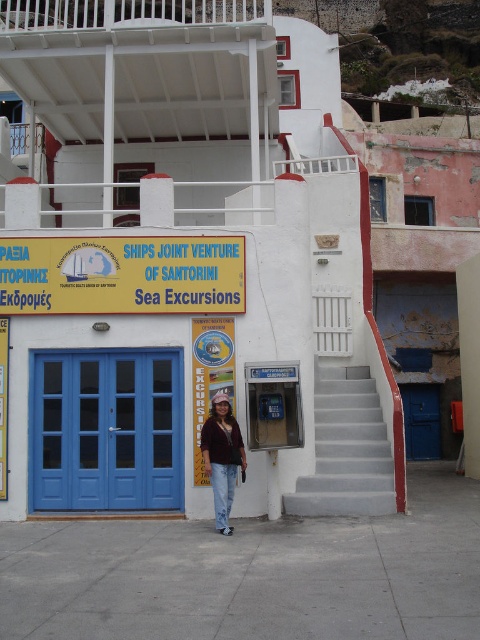
Question: Which object appears closest to the camera in this image?

Choices:
 (A) gray concrete stairs at center
 (B) yellow plastic sign at center
 (C) denim jacket at center
 (D) blue matte door at lower left

Answer: (C)

Question: Can you confirm if yellow plastic sign at center is wider than denim jacket at center?

Choices:
 (A) yes
 (B) no

Answer: (A)

Question: Is blue matte door at lower left to the right of yellow plastic sign at center from the viewer's perspective?

Choices:
 (A) no
 (B) yes

Answer: (A)

Question: Which of the following is the farthest from the observer?

Choices:
 (A) yellow plastic sign at center
 (B) denim jacket at center

Answer: (A)

Question: Does blue matte door at lower left have a larger size compared to yellow plastic sign at center?

Choices:
 (A) yes
 (B) no

Answer: (A)

Question: Which object is the farthest from the gray concrete stairs at center?

Choices:
 (A) yellow plastic sign at center
 (B) denim jacket at center
 (C) blue matte door at lower left

Answer: (A)